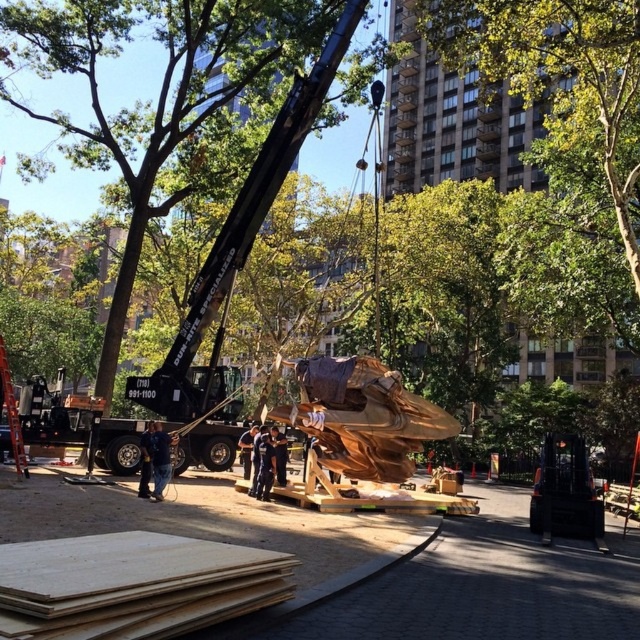
Question: Can you confirm if plywood at lower left is positioned above golden polished wood sculpture at center?

Choices:
 (A) yes
 (B) no

Answer: (A)

Question: Among these objects, which one is nearest to the camera?

Choices:
 (A) wooden boards at center
 (B) plywood at lower left
 (C) blue denim jeans at lower left
 (D) green leafy tree at center

Answer: (B)

Question: Which point appears farthest from the camera in this image?

Choices:
 (A) (211, 173)
 (B) (369, 396)

Answer: (A)

Question: Is wooden boards at center closer to the viewer compared to plywood at lower left?

Choices:
 (A) no
 (B) yes

Answer: (A)

Question: Is wooden boards at center behind blue denim jeans at lower left?

Choices:
 (A) yes
 (B) no

Answer: (B)

Question: Which of the following is the farthest from the observer?

Choices:
 (A) blue denim jeans at lower left
 (B) wooden boards at center

Answer: (A)